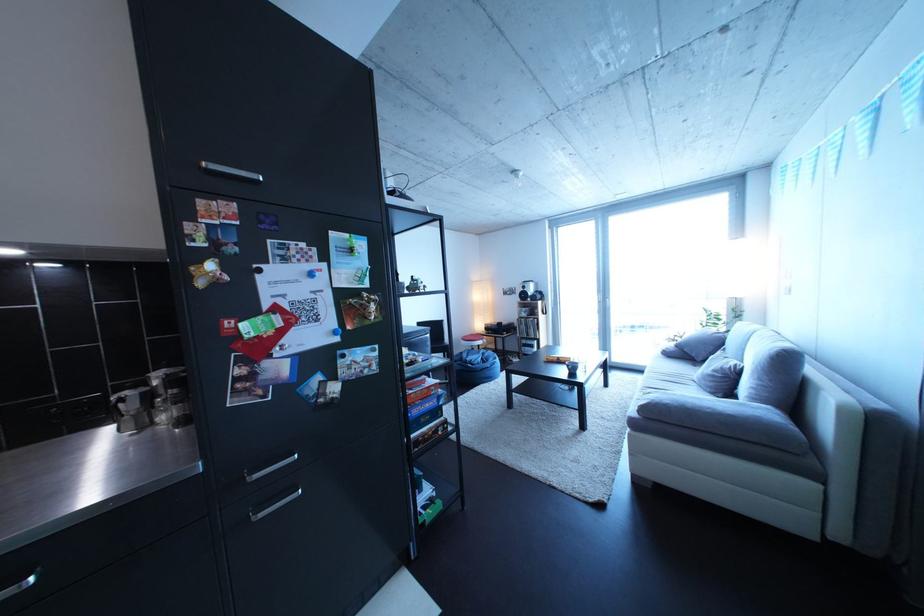
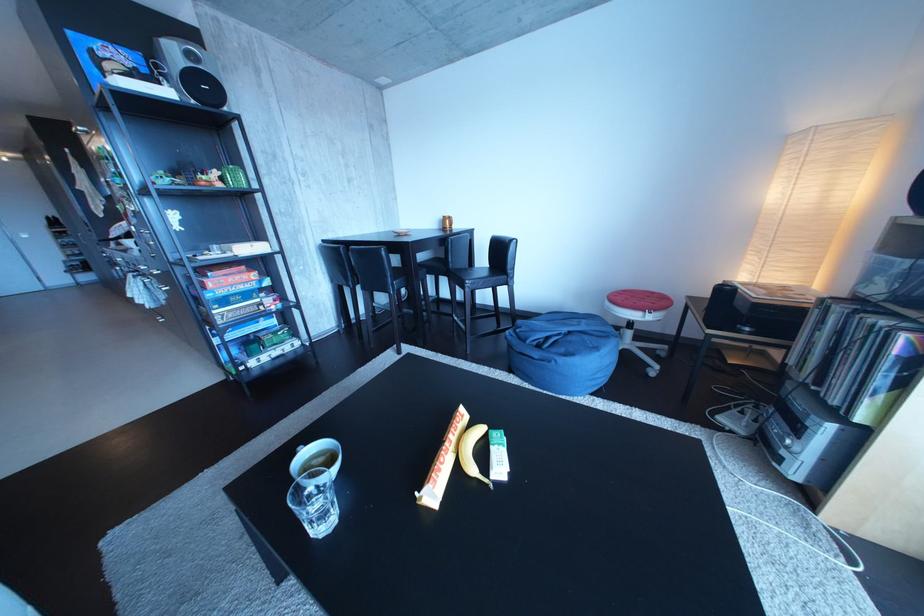
Find the pixel in the second image that matches point 495,360 in the first image.

(582, 339)